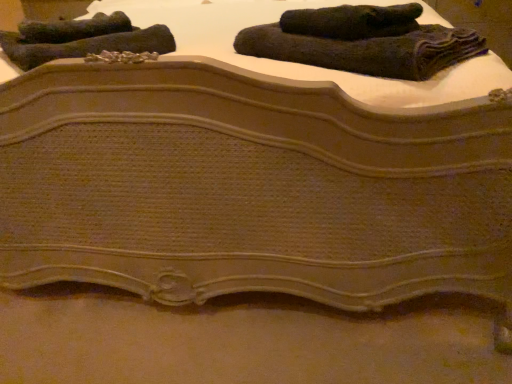
Question: Is dark green textured towel at upper left, which ranks as the third towel in right-to-left order, to the left of dark woolen towel at upper right, which appears as the third towel when viewed from the left, from the viewer's perspective?

Choices:
 (A) no
 (B) yes

Answer: (B)

Question: Does dark green textured towel at upper left, the second towel viewed from the left, appear on the right side of dark woolen towel at upper right, which appears as the third towel when viewed from the left?

Choices:
 (A) no
 (B) yes

Answer: (A)

Question: Is dark green textured towel at upper left, the second towel viewed from the left, oriented away from dark woolen towel at upper right, which appears as the third towel when viewed from the left?

Choices:
 (A) yes
 (B) no

Answer: (B)

Question: Can you confirm if dark green textured towel at upper left, the second towel viewed from the left, is thinner than dark woolen towel at upper right, which is the second towel in right-to-left order?

Choices:
 (A) yes
 (B) no

Answer: (B)

Question: Does dark green textured towel at upper left, the second towel viewed from the left, have a lesser height compared to dark woolen towel at upper right, which is the second towel in right-to-left order?

Choices:
 (A) no
 (B) yes

Answer: (B)

Question: From the image's perspective, is dark gray textured towel at upper left, the first towel viewed from the left, positioned above or below dark green textured towel at upper left, which ranks as the third towel in right-to-left order?

Choices:
 (A) below
 (B) above

Answer: (B)

Question: From a real-world perspective, is dark gray textured towel at upper left, which is counted as the fourth towel, starting from the right, positioned above or below dark green textured towel at upper left, which ranks as the third towel in right-to-left order?

Choices:
 (A) above
 (B) below

Answer: (A)

Question: Is point (53, 34) closer or farther from the camera than point (10, 46)?

Choices:
 (A) farther
 (B) closer

Answer: (A)

Question: Relative to dark green textured towel at upper left, which ranks as the third towel in right-to-left order, is dark gray textured towel at upper left, the first towel viewed from the left, in front or behind?

Choices:
 (A) front
 (B) behind

Answer: (B)

Question: From a real-world perspective, is dark gray textured towel at upper left, the first towel viewed from the left, above or below dark woolen towel at upper center, which appears as the 1th towel when viewed from the right?

Choices:
 (A) below
 (B) above

Answer: (B)

Question: From the image's perspective, is dark gray textured towel at upper left, the first towel viewed from the left, positioned above or below dark woolen towel at upper center, which appears as the 1th towel when viewed from the right?

Choices:
 (A) below
 (B) above

Answer: (B)

Question: Considering the relative positions of dark gray textured towel at upper left, which is counted as the fourth towel, starting from the right, and dark woolen towel at upper center, which appears as the 1th towel when viewed from the right, in the image provided, is dark gray textured towel at upper left, which is counted as the fourth towel, starting from the right, to the left or to the right of dark woolen towel at upper center, which appears as the 1th towel when viewed from the right,?

Choices:
 (A) right
 (B) left

Answer: (B)

Question: Considering the positions of dark gray textured towel at upper left, which is counted as the fourth towel, starting from the right, and dark woolen towel at upper center, which is the 4th towel in left-to-right order, in the image, is dark gray textured towel at upper left, which is counted as the fourth towel, starting from the right, bigger or smaller than dark woolen towel at upper center, which is the 4th towel in left-to-right order,?

Choices:
 (A) big
 (B) small

Answer: (B)

Question: From their relative heights in the image, would you say dark green textured towel at upper left, the second towel viewed from the left, is taller or shorter than dark gray textured towel at upper left, which is counted as the fourth towel, starting from the right?

Choices:
 (A) tall
 (B) short

Answer: (B)

Question: Is dark green textured towel at upper left, the second towel viewed from the left, to the left or to the right of dark gray textured towel at upper left, which is counted as the fourth towel, starting from the right, in the image?

Choices:
 (A) left
 (B) right

Answer: (B)